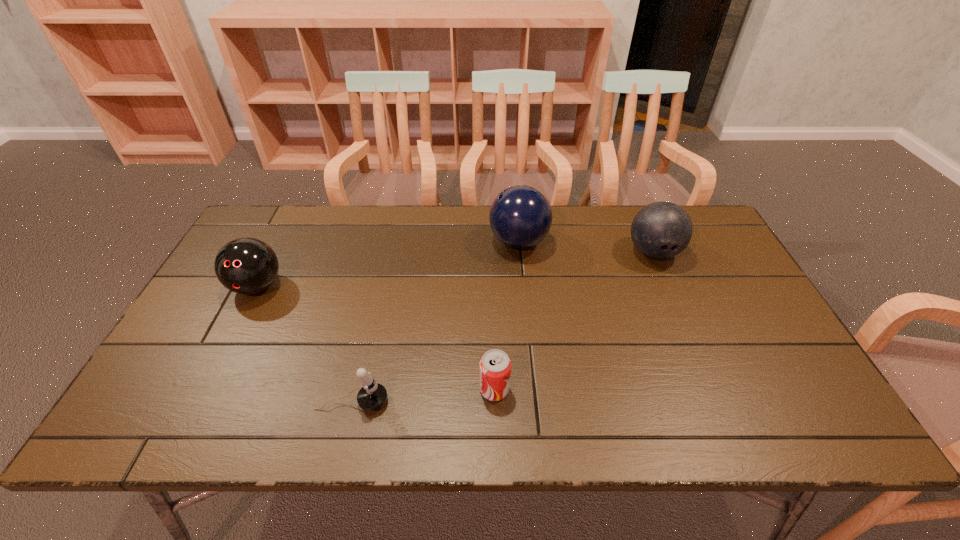
In the image, there is a desktop. At what (x,y) coordinates should I click in order to perform the action: click on free space at the right edge. Please return your answer as a coordinate pair (x, y). The height and width of the screenshot is (540, 960). Looking at the image, I should click on (696, 269).

This screenshot has width=960, height=540. What are the coordinates of `vacant space at the near left corner` in the screenshot? It's located at (129, 433).

In order to click on vacant space at the near right corner of the desktop in this screenshot , I will do point(784,436).

Where is `free space that is in between the rightmost bowling ball and the leftmost object`? free space that is in between the rightmost bowling ball and the leftmost object is located at coordinates (455, 269).

Where is `vacant space that's between the soda can and the microphone`? vacant space that's between the soda can and the microphone is located at coordinates (423, 395).

Where is `free spot between the soda can and the second bowling ball from right to left`? The image size is (960, 540). free spot between the soda can and the second bowling ball from right to left is located at coordinates (507, 315).

Where is `vacant space in between the second object from left to right and the leftmost bowling ball`? The width and height of the screenshot is (960, 540). vacant space in between the second object from left to right and the leftmost bowling ball is located at coordinates (304, 344).

Identify the location of free spot between the soda can and the second bowling ball from left to right. The width and height of the screenshot is (960, 540). (507, 315).

Find the location of a particular element. Image resolution: width=960 pixels, height=540 pixels. free space that is in between the second bowling ball from right to left and the leftmost bowling ball is located at coordinates (388, 264).

You are a GUI agent. You are given a task and a screenshot of the screen. Output one action in this format:
    pyautogui.click(x=<x>, y=<y>)
    Task: Click on the vacant area that lies between the rightmost bowling ball and the fourth object from right to left
    The height and width of the screenshot is (540, 960).
    Given the screenshot: What is the action you would take?
    pyautogui.click(x=503, y=327)